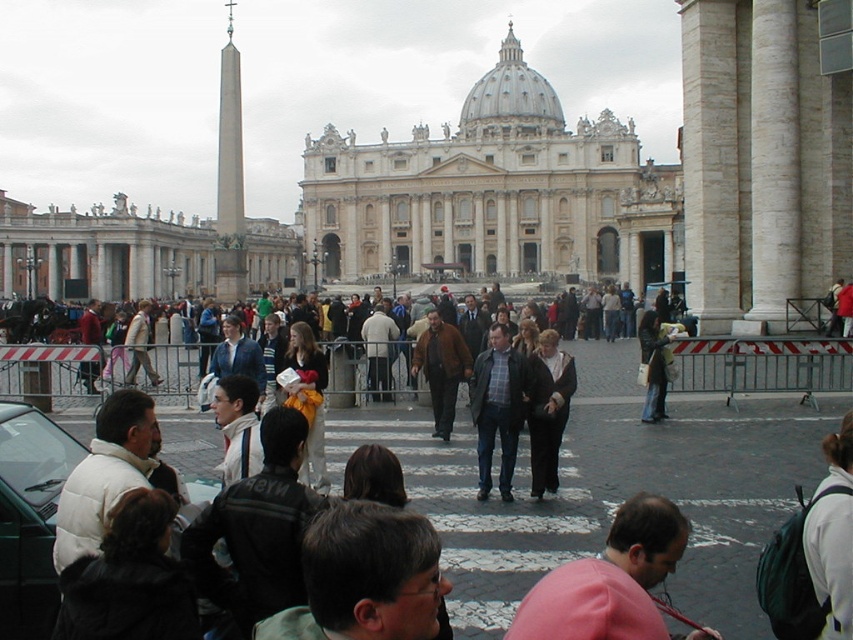
Between point (659, 333) and point (148, 326), which one is positioned in front?

Point (659, 333) is more forward.

Does point (646, 324) come in front of point (142, 308)?

Yes.

The height and width of the screenshot is (640, 853). In order to click on leather jacket at center in this screenshot , I will do `click(653, 365)`.

Can you confirm if dark gray jacket at lower left is smaller than leather jacket at center?

No, dark gray jacket at lower left is not smaller than leather jacket at center.

Which is above, dark gray jacket at lower left or leather jacket at center?

leather jacket at center is higher up.

Locate an element on the screen. The width and height of the screenshot is (853, 640). dark gray jacket at lower left is located at coordinates (257, 529).

Locate an element on the screen. This screenshot has height=640, width=853. dark gray jacket at lower left is located at coordinates (257, 529).

Which is in front, point (552, 440) or point (355, 449)?

Point (552, 440) is in front.

Which is more to the right, black fabric coat at center or brown hair at center?

black fabric coat at center

Who is more distant from viewer, [556,376] or [393,500]?

The point [556,376] is more distant.

Identify the location of black fabric coat at center. (548, 410).